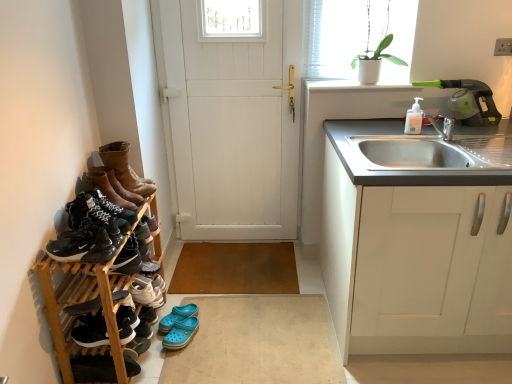
You are a GUI agent. You are given a task and a screenshot of the screen. Output one action in this format:
    pyautogui.click(x=<x>, y=<y>)
    Task: Click on the free point in front of white plastic soap dispenser at upper right
    This screenshot has height=384, width=512.
    Given the screenshot: What is the action you would take?
    pyautogui.click(x=418, y=133)